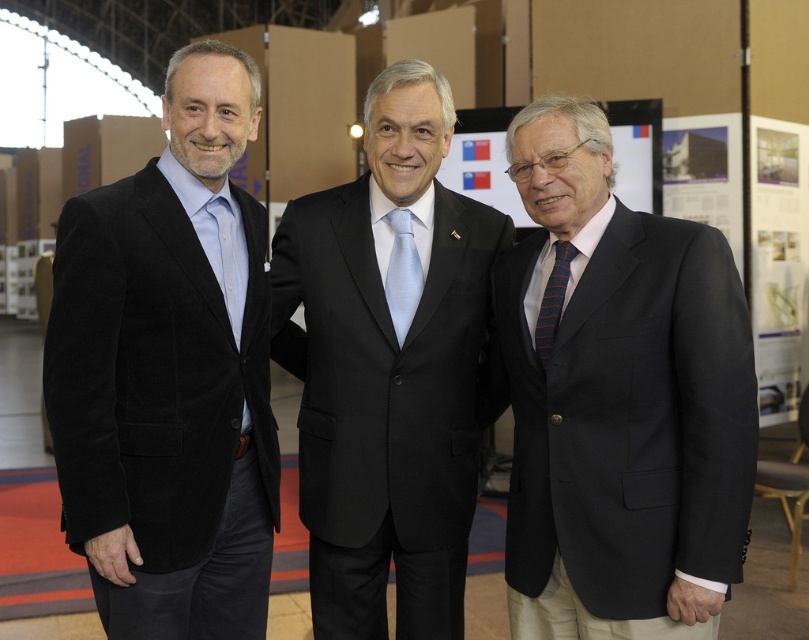
You are a photographer at a formal event. You need to capture a photo of the velvet black suit at left and the light blue silk tie at center. Which one will appear closer to the camera in the photo?

The velvet black suit at left will appear closer to the camera in the photo because it is in front of the light blue silk tie at center.

You are a photographer at a formal event. You need to capture a clear photo of the striped fabric tie at center without the black satin suit at center blocking it. How can you adjust your position to achieve this?

The striped fabric tie at center is behind the black satin suit at center. To capture the tie without obstruction, move to a position where you can see the tie from an angle that places the black satin suit at center out of the frame or behind the tie.